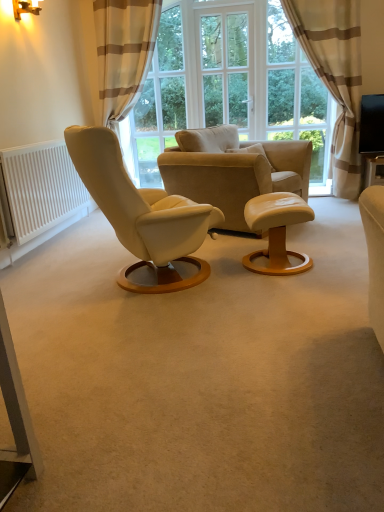
Question: From the image's perspective, is matte white stool at center over white matte radiator at left?

Choices:
 (A) no
 (B) yes

Answer: (A)

Question: Could you tell me if matte white stool at center is turned towards white matte radiator at left?

Choices:
 (A) yes
 (B) no

Answer: (B)

Question: Is matte white stool at center bigger than white matte radiator at left?

Choices:
 (A) no
 (B) yes

Answer: (A)

Question: Is matte white stool at center smaller than white matte radiator at left?

Choices:
 (A) yes
 (B) no

Answer: (A)

Question: Can you confirm if matte white stool at center is positioned to the right of white matte radiator at left?

Choices:
 (A) no
 (B) yes

Answer: (B)

Question: In terms of height, does wooden round table at center look taller or shorter compared to beige striped curtain at upper left, placed as the 1th curtain when sorted from left to right?

Choices:
 (A) tall
 (B) short

Answer: (B)

Question: From the image's perspective, is wooden round table at center positioned above or below beige striped curtain at upper left, placed as the 1th curtain when sorted from left to right?

Choices:
 (A) above
 (B) below

Answer: (B)

Question: From a real-world perspective, is wooden round table at center positioned above or below beige striped curtain at upper left, placed as the 1th curtain when sorted from left to right?

Choices:
 (A) above
 (B) below

Answer: (B)

Question: Is wooden round table at center in front of or behind beige striped curtain at upper left, which is the second curtain in right-to-left order, in the image?

Choices:
 (A) behind
 (B) front

Answer: (A)

Question: From a real-world perspective, is beige striped curtain at upper left, placed as the 1th curtain when sorted from left to right, above or below beige striped curtain at upper right, the first curtain viewed from the right?

Choices:
 (A) above
 (B) below

Answer: (A)

Question: Is beige striped curtain at upper left, which is the second curtain in right-to-left order, in front of or behind beige striped curtain at upper right, the first curtain viewed from the right, in the image?

Choices:
 (A) behind
 (B) front

Answer: (A)

Question: Looking at their shapes, would you say beige striped curtain at upper left, which is the second curtain in right-to-left order, is wider or thinner than beige striped curtain at upper right, the first curtain viewed from the right?

Choices:
 (A) thin
 (B) wide

Answer: (B)

Question: Is beige striped curtain at upper left, placed as the 1th curtain when sorted from left to right, inside or outside of beige striped curtain at upper right, which appears as the second curtain when viewed from the left?

Choices:
 (A) outside
 (B) inside

Answer: (A)

Question: In terms of width, does transparent glass window at center, positioned as the 2th window screen in right-to-left order, look wider or thinner when compared to beige striped curtain at upper right, the first curtain viewed from the right?

Choices:
 (A) thin
 (B) wide

Answer: (A)

Question: Is transparent glass window at center, arranged as the 1th window screen when viewed from the left, to the left or to the right of beige striped curtain at upper right, the first curtain viewed from the right, in the image?

Choices:
 (A) left
 (B) right

Answer: (A)